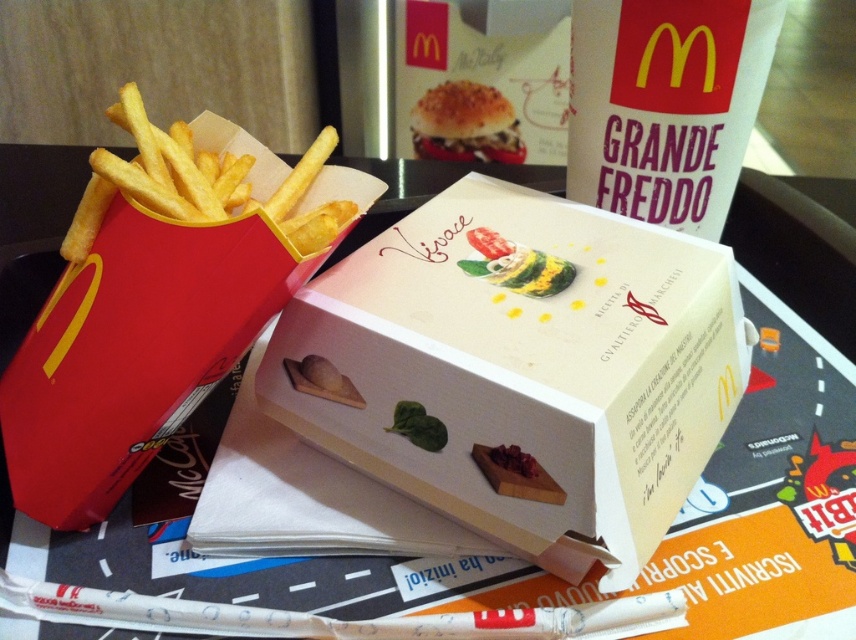
Who is shorter, matte cardboard box at left or smooth green leaf at center?

Standing shorter between the two is smooth green leaf at center.

Locate an element on the screen. matte cardboard box at left is located at coordinates (131, 353).

Between point (152, 246) and point (521, 280), which one is positioned in front?

Point (152, 246)

Locate an element on the screen. The image size is (856, 640). matte cardboard box at left is located at coordinates (131, 353).

Does matte cardboard box at left have a smaller size compared to breaded crispy bun at upper center?

No.

Between matte cardboard box at left and breaded crispy bun at upper center, which one has more height?

matte cardboard box at left is taller.

Which is behind, point (122, 259) or point (492, 118)?

Positioned behind is point (492, 118).

Find the location of `matte cardboard box at left`. matte cardboard box at left is located at coordinates (131, 353).

Which is above, white cardboard box at center or matte cardboard box at left?

Positioned higher is matte cardboard box at left.

This screenshot has height=640, width=856. Identify the location of white cardboard box at center. (521, 372).

At what (x,y) coordinates should I click in order to perform the action: click on white cardboard box at center. Please return your answer as a coordinate pair (x, y). This screenshot has width=856, height=640. Looking at the image, I should click on (521, 372).